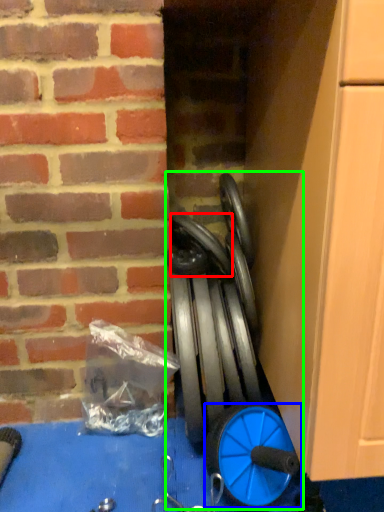
Question: Estimate the real-world distances between objects in this image. Which object is closer to car tire (highlighted by a red box), wheel (highlighted by a blue box) or sport equipment (highlighted by a green box)?

Choices:
 (A) wheel
 (B) sport equipment

Answer: (B)